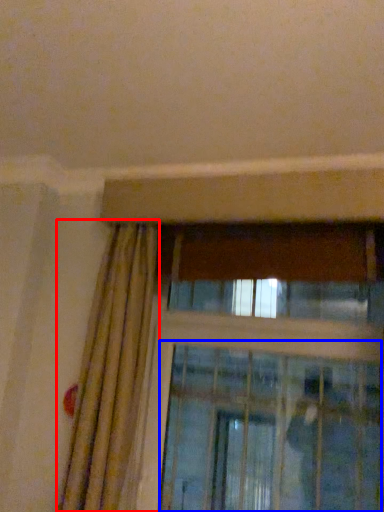
Question: Which point is further to the camera, curtain (highlighted by a red box) or screen door (highlighted by a blue box)?

Choices:
 (A) curtain
 (B) screen door

Answer: (B)